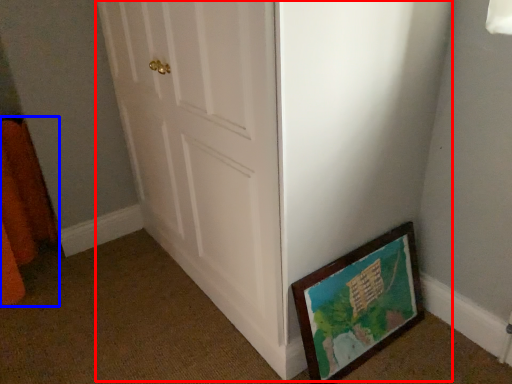
Question: Which point is closer to the camera, door (highlighted by a red box) or curtain (highlighted by a blue box)?

Choices:
 (A) door
 (B) curtain

Answer: (A)